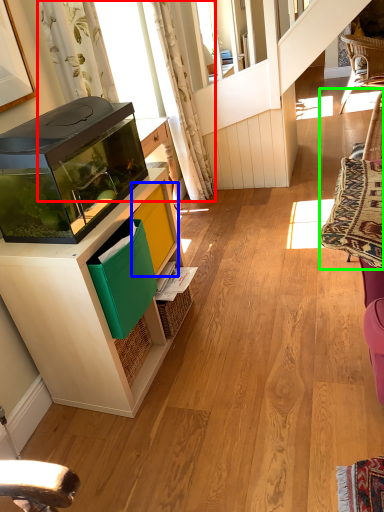
Question: Which is nearer to the curtain (highlighted by a red box)? shelf (highlighted by a blue box) or swivel chair (highlighted by a green box).

Choices:
 (A) shelf
 (B) swivel chair

Answer: (A)